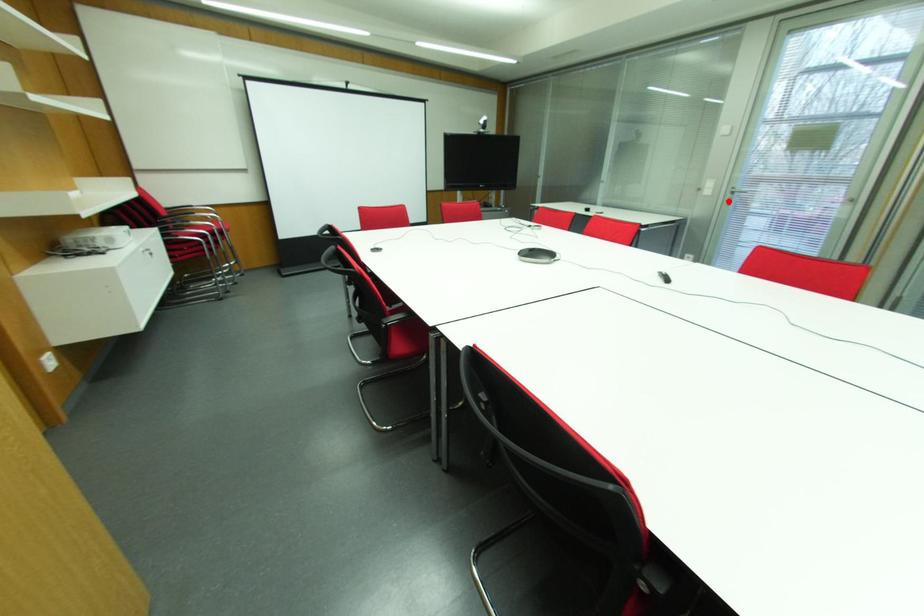
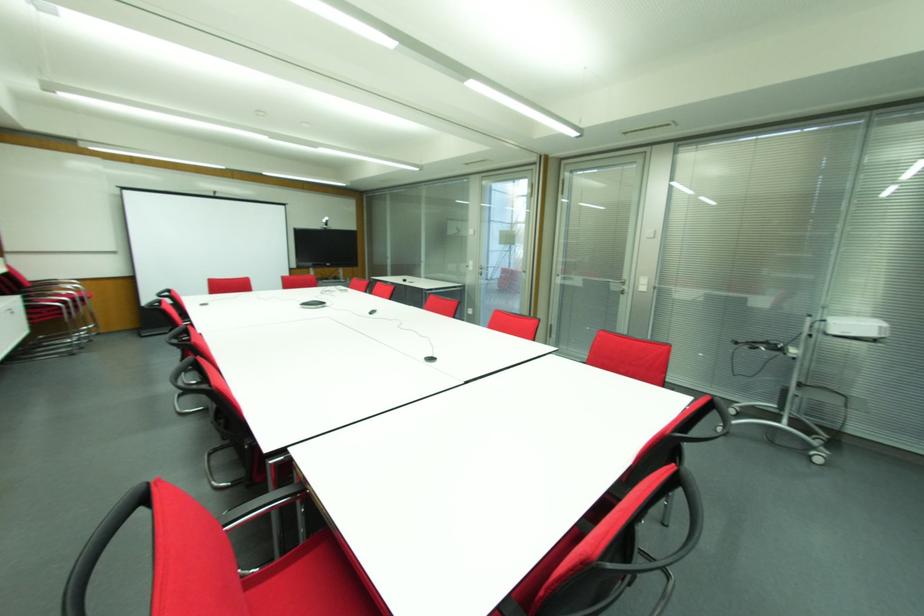
The point at the highlighted location is marked in the first image. Where is the corresponding point in the second image?

(480, 274)